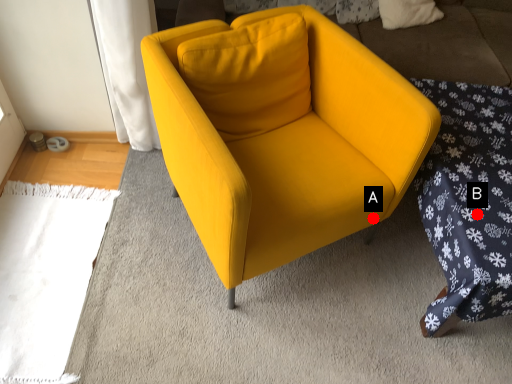
Question: Two points are circled on the image, labeled by A and B beside each circle. Which point is farther to the camera?

Choices:
 (A) A is further
 (B) B is further

Answer: (A)